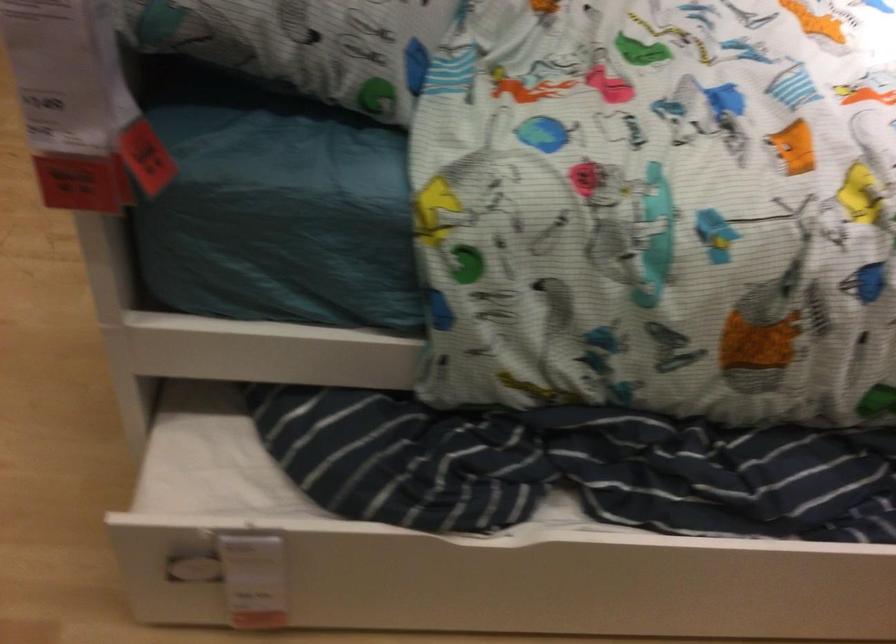
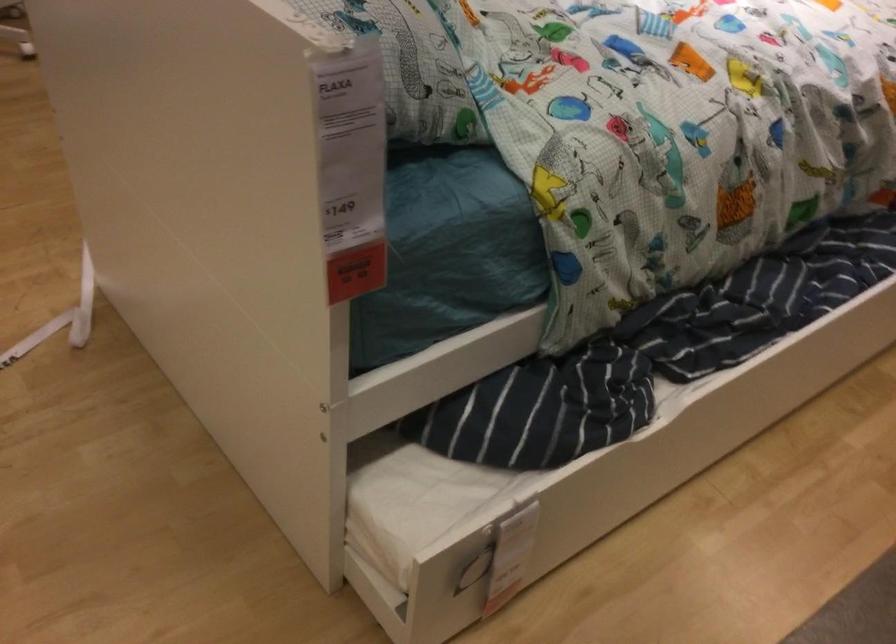
Question: Based on the continuous images, in which direction is the camera rotating? Reply with the corresponding letter.

Choices:
 (A) Left
 (B) Right
 (C) Up
 (D) Down

Answer: (B)